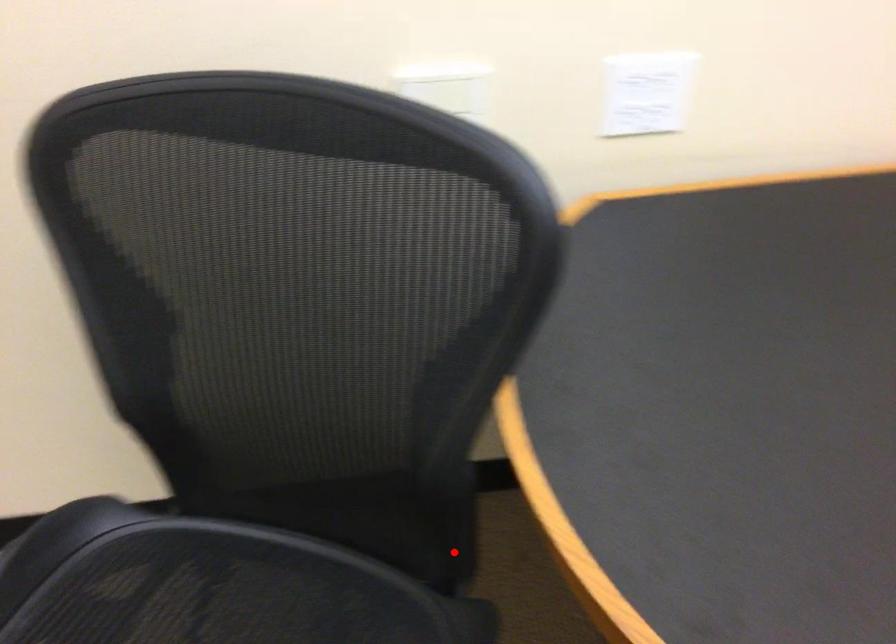
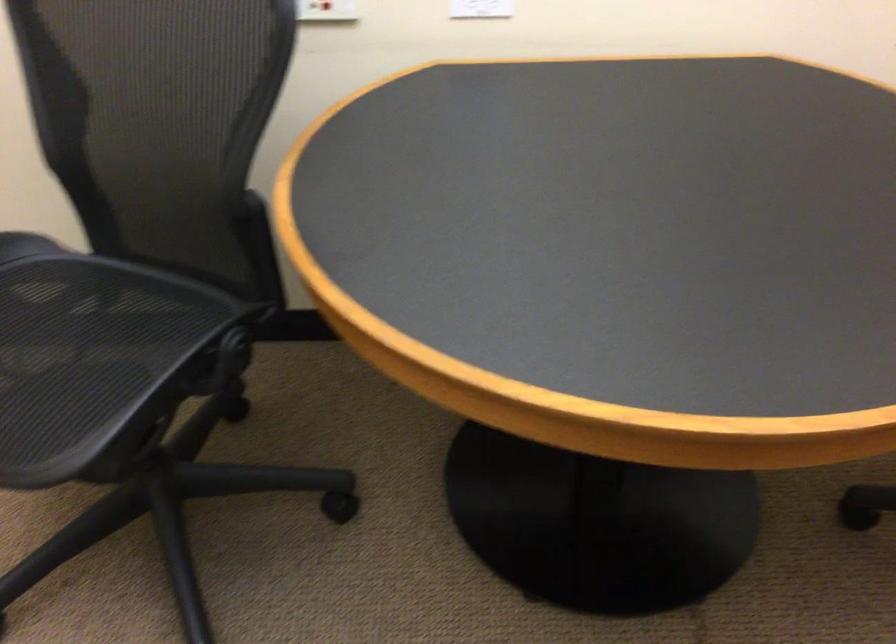
Question: A red point is marked in image1. In image2, is the corresponding 3D point closer to the camera or farther? Reply with the corresponding letter.

Choices:
 (A) The corresponding 3D point is closer.
 (B) The corresponding 3D point is farther.

Answer: (B)